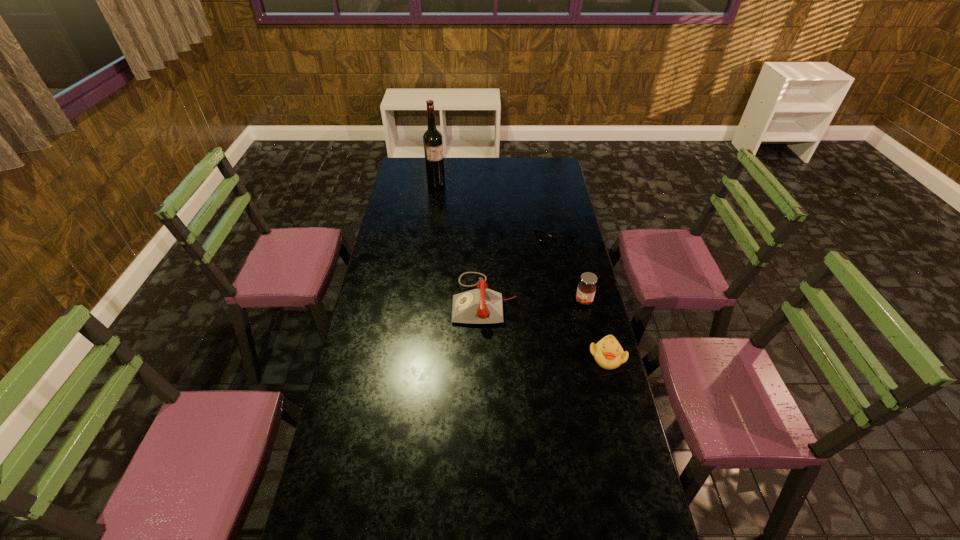
Find the location of a particular element. free space located 0.180m at the face of the nearest object is located at coordinates (623, 420).

Identify the location of vacant space located 0.120m on the front and back of the tallest object. (447, 200).

Identify the location of free location located on the front and back of the tallest object. The width and height of the screenshot is (960, 540). (466, 225).

You are a GUI agent. You are given a task and a screenshot of the screen. Output one action in this format:
    pyautogui.click(x=<x>, y=<y>)
    Task: Click on the blank space located on the front and back of the tallest object
    Image resolution: width=960 pixels, height=540 pixels.
    Given the screenshot: What is the action you would take?
    pyautogui.click(x=444, y=194)

You are a GUI agent. You are given a task and a screenshot of the screen. Output one action in this format:
    pyautogui.click(x=<x>, y=<y>)
    Task: Click on the vacant space located on the front-facing side of the shortest object
    The width and height of the screenshot is (960, 540).
    Given the screenshot: What is the action you would take?
    pyautogui.click(x=543, y=268)

You are a GUI agent. You are given a task and a screenshot of the screen. Output one action in this format:
    pyautogui.click(x=<x>, y=<y>)
    Task: Click on the blank space located on the front-facing side of the shortest object
    This screenshot has height=540, width=960.
    Given the screenshot: What is the action you would take?
    pyautogui.click(x=534, y=299)

This screenshot has height=540, width=960. I want to click on free region located 0.100m on the front-facing side of the shortest object, so click(545, 262).

At what (x,y) coordinates should I click in order to perform the action: click on blank space located 0.330m on the label side of the jam. Please return your answer as a coordinate pair (x, y). This screenshot has width=960, height=540. Looking at the image, I should click on (506, 337).

Where is `free space located on the label side of the jam`? The image size is (960, 540). free space located on the label side of the jam is located at coordinates (490, 345).

The height and width of the screenshot is (540, 960). I want to click on vacant space situated 0.150m on the label side of the jam, so click(546, 319).